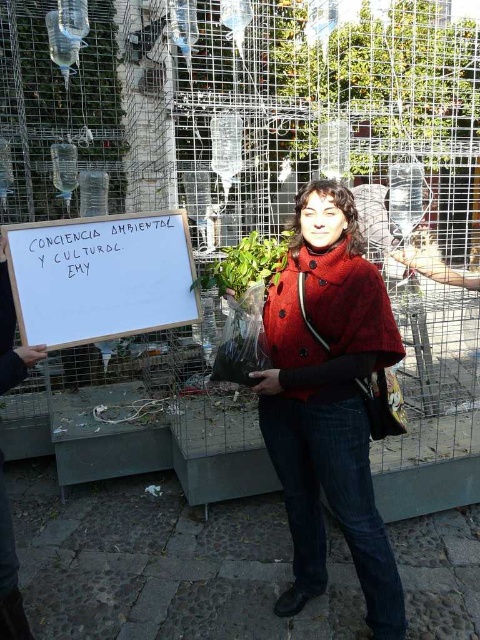
You are an artist planning to hang a small hook on the wall behind the knitted woolen cape at center and the white wood sign at center. To ensure the hook is placed above both items without being too high, where should you position it?

The knitted woolen cape at center has a greater height compared to white wood sign at center, so the hook should be placed above the knitted woolen cape at center to accommodate its height and still be accessible.

You are a photographer trying to capture the white wood sign at center without the knitted woolen cape at center blocking it. Can you move your position to achieve this?

The knitted woolen cape at center is further to the viewer than the white wood sign at center. To avoid blocking the sign, move your position so that the sign is positioned between you and the cape.

You are a photographer trying to capture the knitted woolen cape at center in focus while ensuring the metal cage structure behind it is also somewhat visible. Given that your camera has a depth of field that can cover objects within a 5 feet range, will you be able to achieve this?

The knitted woolen cape at center is 6.64 feet from the camera, which is beyond the 5 feet depth of field range. Therefore, the cape will be out of focus, and the metal cage structure behind it may not be visible clearly either.